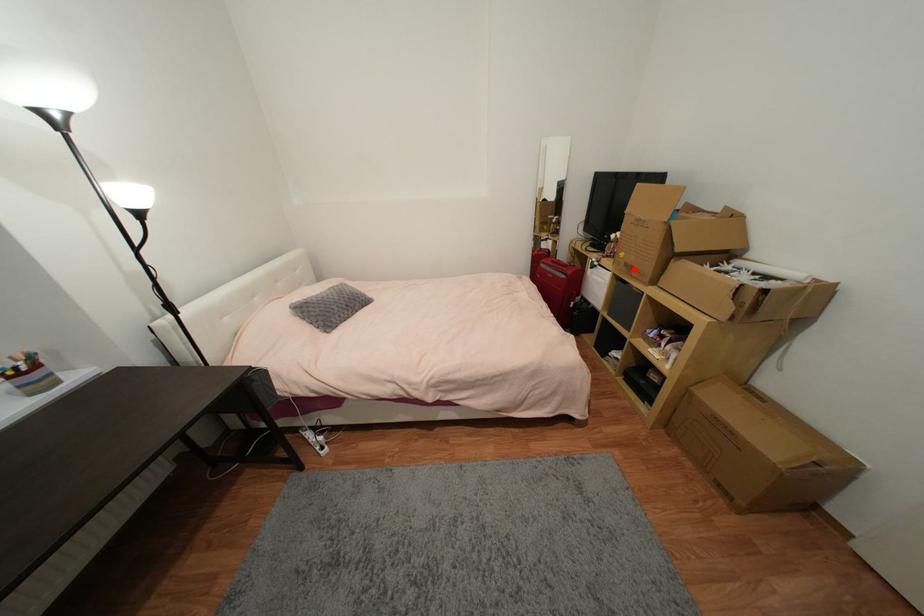
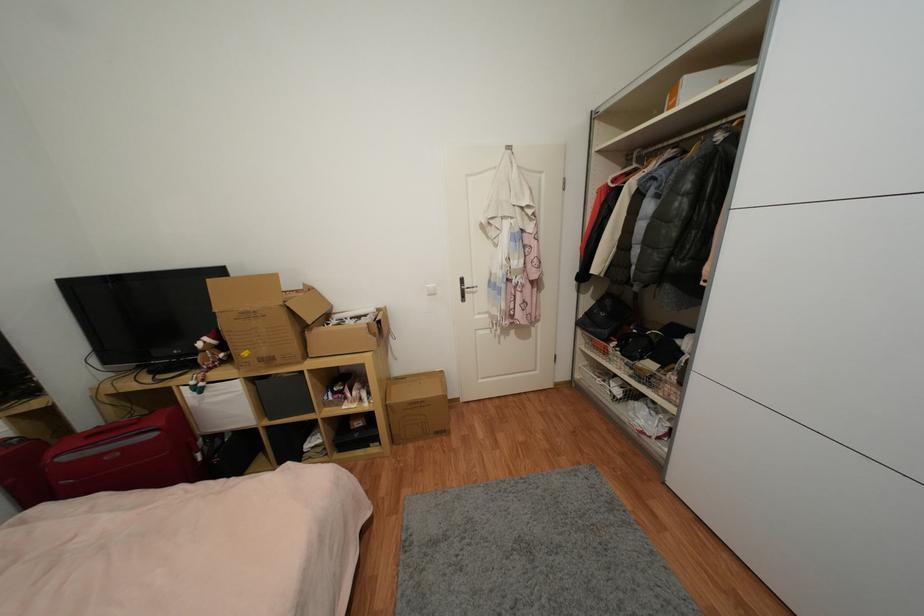
Where in the second image is the point corresponding to the highlighted location from the first image?

(274, 361)